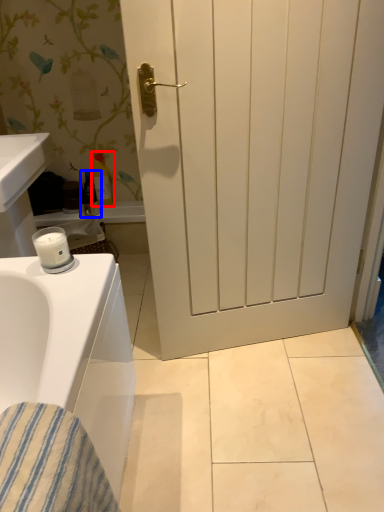
Question: Which of the following is the closest to the observer, toiletry (highlighted by a red box) or toiletry (highlighted by a blue box)?

Choices:
 (A) toiletry
 (B) toiletry

Answer: (A)